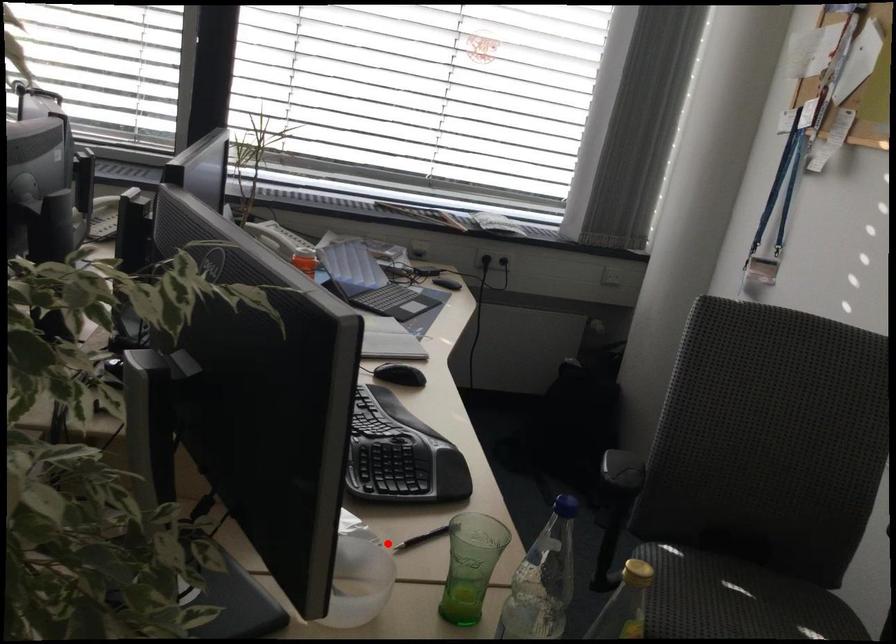
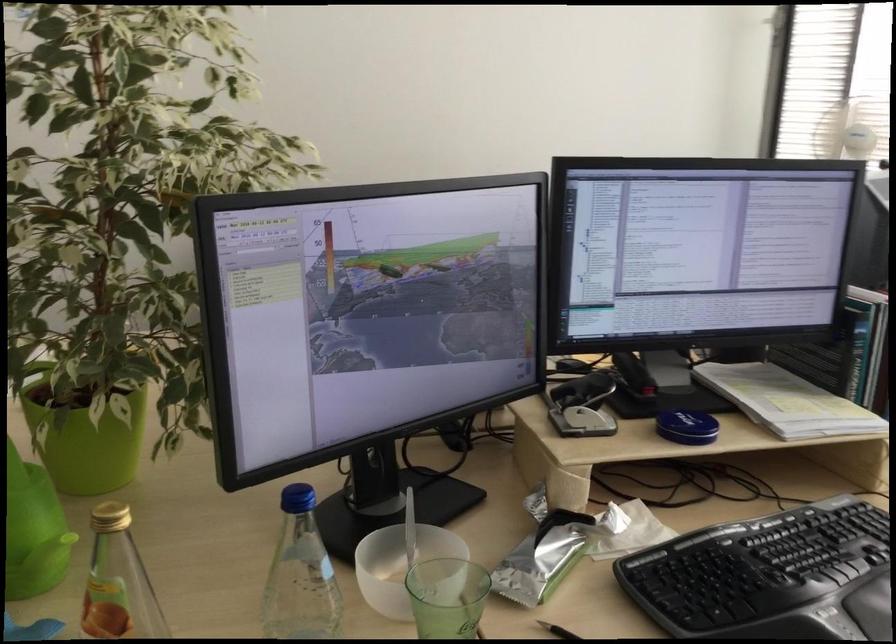
Locate, in the second image, the point that corresponds to the highlighted location in the first image.

(557, 630)